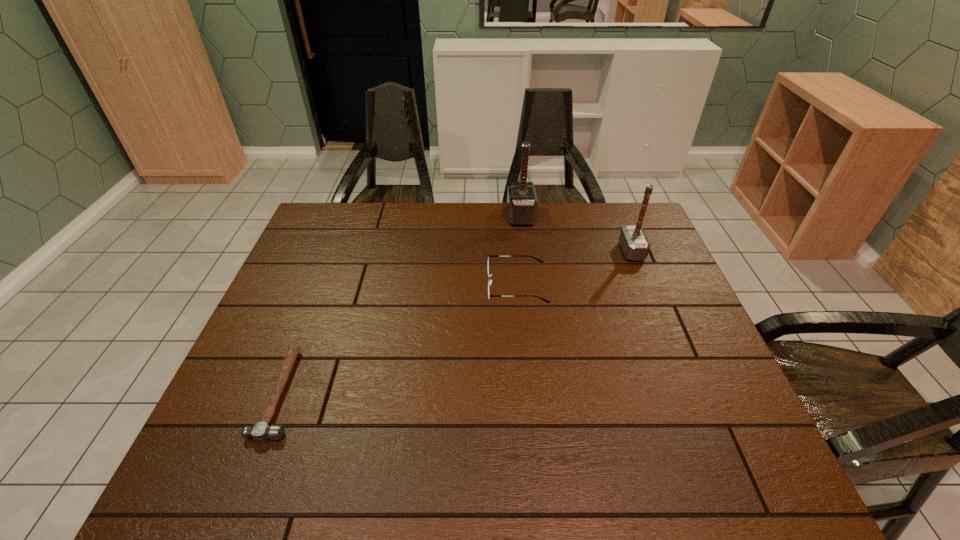
The width and height of the screenshot is (960, 540). In order to click on the farthest object in this screenshot , I will do `click(522, 203)`.

Find the location of a particular element. Image resolution: width=960 pixels, height=540 pixels. the second hammer from right to left is located at coordinates (522, 203).

This screenshot has width=960, height=540. I want to click on the second farthest hammer, so tap(634, 243).

Identify the location of the second farthest object. The height and width of the screenshot is (540, 960). (634, 243).

Locate an element on the screen. The height and width of the screenshot is (540, 960). the third tallest object is located at coordinates (490, 281).

This screenshot has height=540, width=960. I want to click on spectacles, so click(x=490, y=281).

Locate an element on the screen. The height and width of the screenshot is (540, 960). the nearest object is located at coordinates (261, 431).

Identify the location of the leftmost object. (261, 431).

What are the coordinates of `vacant space situated on the front of the farthest object` in the screenshot? It's located at (530, 292).

You are a GUI agent. You are given a task and a screenshot of the screen. Output one action in this format:
    pyautogui.click(x=<x>, y=<y>)
    Task: Click on the vacant space located on the striking surface of the rightmost hammer
    This screenshot has width=960, height=540.
    Given the screenshot: What is the action you would take?
    pyautogui.click(x=548, y=251)